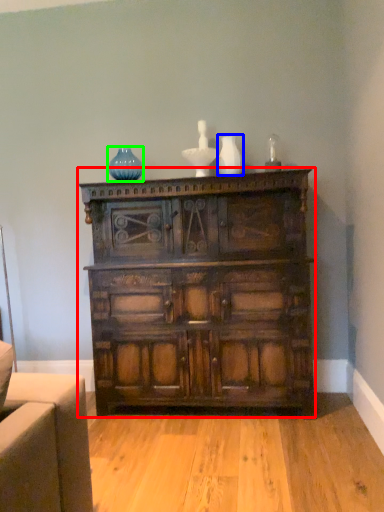
Question: Which object is the farthest from chest of drawers (highlighted by a red box)? Choose among these: vase (highlighted by a blue box) or glass vase (highlighted by a green box).

Choices:
 (A) vase
 (B) glass vase

Answer: (B)